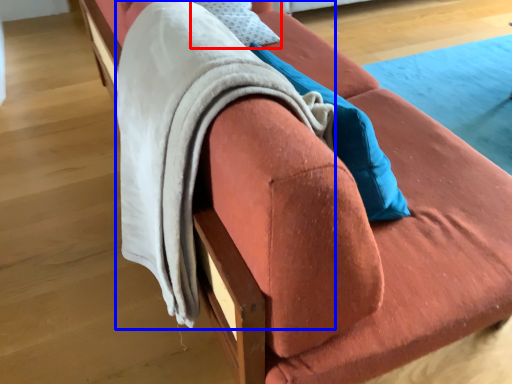
Question: Which object is further to the camera taking this photo, pillow (highlighted by a red box) or blanket (highlighted by a blue box)?

Choices:
 (A) pillow
 (B) blanket

Answer: (A)